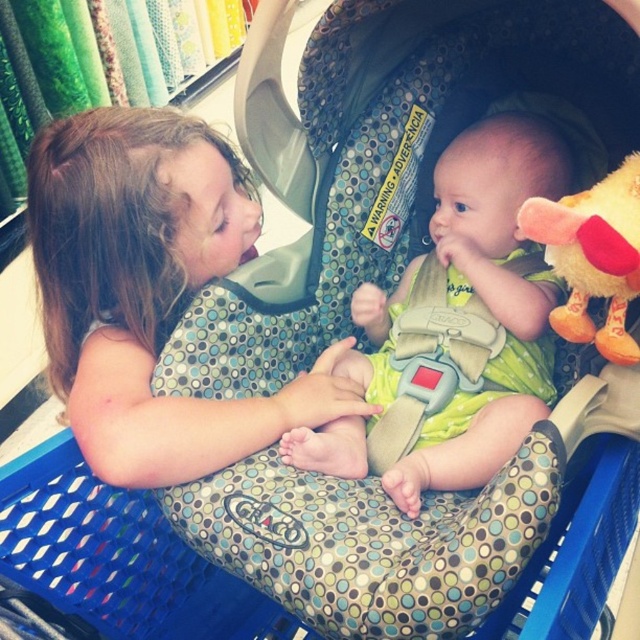
Looking at this image, you are a parent trying to ensure your baby stays safe in the shopping cart. You notice the matte green fabric at center and the fluffy yellow plush toy at right. Which object is higher in height?

The matte green fabric at center is taller than the fluffy yellow plush toy at right.

You are a delivery robot with a height of 36 inches. You need to pass through the area near the point located at coordinates (170, 164) in the image. Will you be able to pass through without hitting your head?

The distance of point (170, 164) from the camera is 35.30 inches. Since the robot is 36 inches tall, it will not be able to pass through without hitting its head because the clearance is slightly less than the robot height.